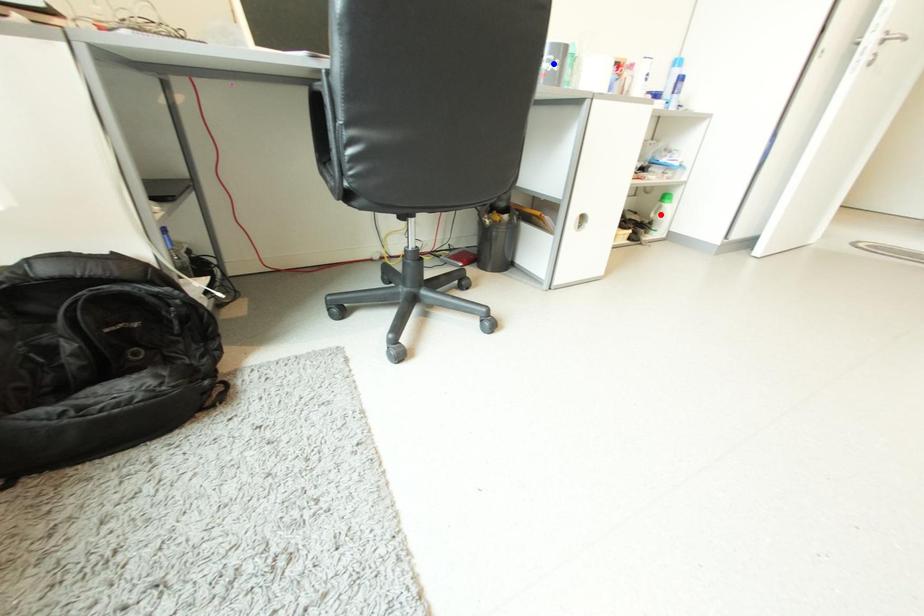
Question: Two points are marked on the image. Which point is closer to the camera?

Choices:
 (A) Blue point is closer.
 (B) Red point is closer.

Answer: (A)